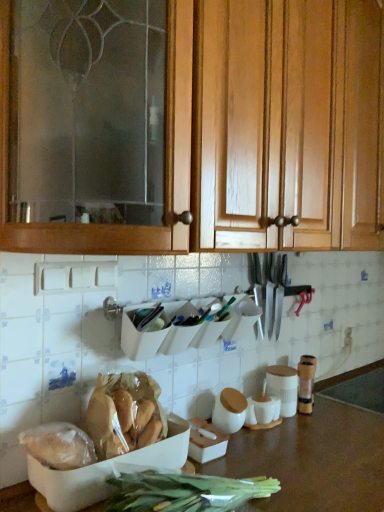
Question: Does brown matte countertop at lower center turn towards polished silver knife set at center?

Choices:
 (A) yes
 (B) no

Answer: (B)

Question: Is the surface of brown matte countertop at lower center in direct contact with polished silver knife set at center?

Choices:
 (A) no
 (B) yes

Answer: (A)

Question: Is brown matte countertop at lower center thinner than polished silver knife set at center?

Choices:
 (A) yes
 (B) no

Answer: (B)

Question: Is brown matte countertop at lower center to the left of polished silver knife set at center from the viewer's perspective?

Choices:
 (A) no
 (B) yes

Answer: (A)

Question: Can you confirm if brown matte countertop at lower center is taller than polished silver knife set at center?

Choices:
 (A) yes
 (B) no

Answer: (A)

Question: Is the position of brown matte countertop at lower center more distant than that of polished silver knife set at center?

Choices:
 (A) no
 (B) yes

Answer: (A)

Question: Can you confirm if wooden cabinet at upper center is taller than brown matte countertop at lower center?

Choices:
 (A) no
 (B) yes

Answer: (B)

Question: Does wooden cabinet at upper center have a larger size compared to brown matte countertop at lower center?

Choices:
 (A) yes
 (B) no

Answer: (B)

Question: Is wooden cabinet at upper center at the left side of brown matte countertop at lower center?

Choices:
 (A) yes
 (B) no

Answer: (A)

Question: Does wooden cabinet at upper center touch brown matte countertop at lower center?

Choices:
 (A) no
 (B) yes

Answer: (A)

Question: Is wooden cabinet at upper center at the right side of brown matte countertop at lower center?

Choices:
 (A) no
 (B) yes

Answer: (A)

Question: Is wooden cabinet at upper center completely or partially outside of brown matte countertop at lower center?

Choices:
 (A) yes
 (B) no

Answer: (A)

Question: Is brown matte countertop at lower center in front of translucent plastic bag of bread at lower left, the second food in the left-to-right sequence?

Choices:
 (A) yes
 (B) no

Answer: (A)